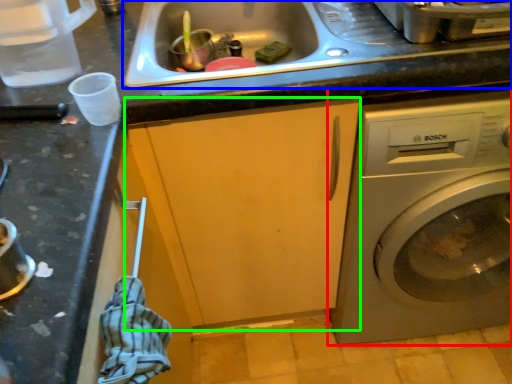
Question: Which is farther away from washing machine (highlighted by a red box)? sink (highlighted by a blue box) or cabinetry (highlighted by a green box)?

Choices:
 (A) sink
 (B) cabinetry

Answer: (A)